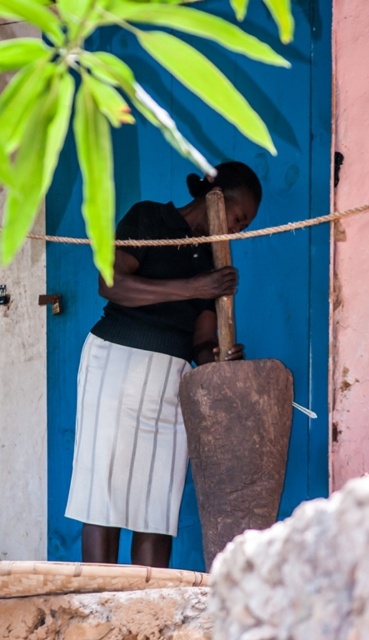
Question: Does rusty metal shovel at center come behind roperough at center?

Choices:
 (A) no
 (B) yes

Answer: (B)

Question: Is matte black shirt at center positioned behind rusty metal shovel at center?

Choices:
 (A) no
 (B) yes

Answer: (B)

Question: Is rusty metal shovel at center smaller than roperough at center?

Choices:
 (A) yes
 (B) no

Answer: (A)

Question: Which object is farther from the camera taking this photo?

Choices:
 (A) matte black shirt at center
 (B) rusty metal shovel at center
 (C) roperough at center

Answer: (A)

Question: Which point appears closest to the camera in this image?

Choices:
 (A) tap(225, 189)
 (B) tap(278, 424)

Answer: (B)

Question: Which object appears farthest from the camera in this image?

Choices:
 (A) roperough at center
 (B) rusty metal shovel at center

Answer: (B)